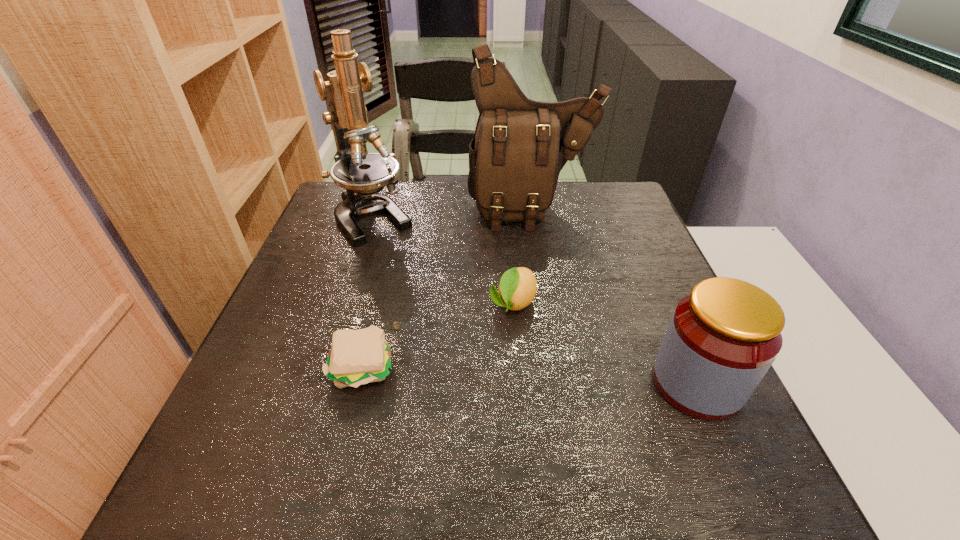
This screenshot has height=540, width=960. Find the location of `free region at the near edge of the desktop`. free region at the near edge of the desktop is located at coordinates (383, 407).

The width and height of the screenshot is (960, 540). In the image, there is a desktop. Find the location of `vacant space at the left edge`. vacant space at the left edge is located at coordinates (242, 390).

In the image, there is a desktop. Identify the location of vacant space at the right edge. (621, 260).

This screenshot has width=960, height=540. What are the coordinates of `vacant space at the far left corner` in the screenshot? It's located at tap(346, 191).

You are a GUI agent. You are given a task and a screenshot of the screen. Output one action in this format:
    pyautogui.click(x=<x>, y=<y>)
    Task: Click on the vacant space at the near left corner of the desktop
    The height and width of the screenshot is (540, 960).
    Given the screenshot: What is the action you would take?
    pyautogui.click(x=266, y=409)

Image resolution: width=960 pixels, height=540 pixels. I want to click on unoccupied position between the jar and the microscope, so click(535, 301).

I want to click on empty location between the shoulder bag and the jar, so (614, 297).

The width and height of the screenshot is (960, 540). What are the coordinates of `vacant point located between the microscope and the shortest object` in the screenshot? It's located at (368, 293).

Where is `vacant point located between the fourth tallest object and the patty`? vacant point located between the fourth tallest object and the patty is located at coordinates (438, 335).

This screenshot has width=960, height=540. I want to click on free space between the microscope and the third farthest object, so click(x=443, y=261).